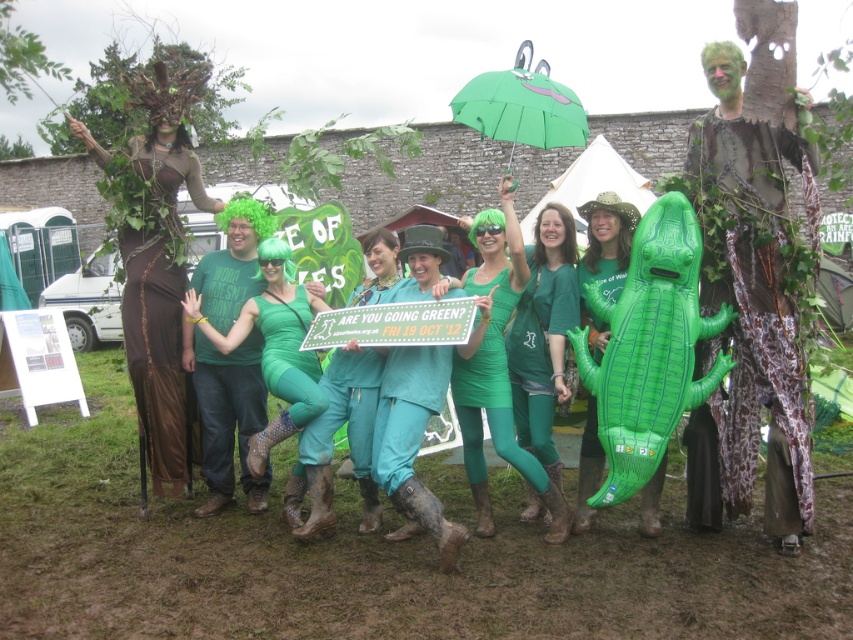
Does teal fabric pants at center have a greater width compared to green matte rubber boots at center?

Correct, the width of teal fabric pants at center exceeds that of green matte rubber boots at center.

Does teal fabric pants at center have a lesser height compared to green matte rubber boots at center?

Yes, teal fabric pants at center is shorter than green matte rubber boots at center.

Is point (323, 380) more distant than point (473, 276)?

No, (323, 380) is in front of (473, 276).

Find the location of `teal fabric pants at center`. teal fabric pants at center is located at coordinates coord(347,436).

Which is below, camouflage fabric tree at right or teal fabric pants at center?

teal fabric pants at center is lower down.

Is camouflage fabric tree at right smaller than teal fabric pants at center?

Actually, camouflage fabric tree at right might be larger than teal fabric pants at center.

Measure the distance between camouflage fabric tree at right and camera.

4.29 meters

At what (x,y) coordinates should I click in order to perform the action: click on camouflage fabric tree at right. Please return your answer as a coordinate pair (x, y). This screenshot has height=640, width=853. Looking at the image, I should click on (755, 308).

Can you confirm if green matte rubber boots at center is positioned to the right of green matte bodysuit at center?

Correct, you'll find green matte rubber boots at center to the right of green matte bodysuit at center.

Which is behind, point (498, 433) or point (312, 301)?

Point (312, 301)

Which is in front, point (497, 358) or point (309, 413)?

Point (309, 413) is more forward.

You are a GUI agent. You are given a task and a screenshot of the screen. Output one action in this format:
    pyautogui.click(x=<x>, y=<y>)
    Task: Click on the green matte rubber boots at center
    This screenshot has height=640, width=853.
    Given the screenshot: What is the action you would take?
    pyautogui.click(x=490, y=390)